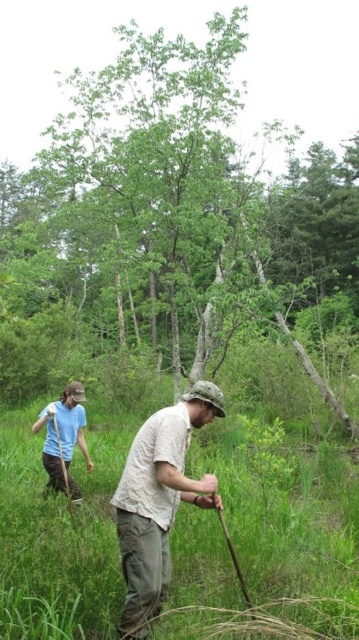
Question: Which of these objects is positioned closest to the matte blue shirt at left?

Choices:
 (A) beige cotton shirt at center
 (B) green grassy at center

Answer: (A)

Question: Considering the relative positions of green grassy at center and matte blue shirt at left in the image provided, where is green grassy at center located with respect to matte blue shirt at left?

Choices:
 (A) below
 (B) above

Answer: (A)

Question: Which object is positioned farthest from the green grassy at center?

Choices:
 (A) matte blue shirt at left
 (B) beige cotton shirt at center

Answer: (A)

Question: Among these objects, which one is farthest from the camera?

Choices:
 (A) green leafy tree at center
 (B) green grassy at center
 (C) matte blue shirt at left
 (D) beige cotton shirt at center

Answer: (A)

Question: Can you confirm if green grassy at center is positioned above beige cotton shirt at center?

Choices:
 (A) no
 (B) yes

Answer: (A)

Question: Can you confirm if green leafy tree at center is positioned to the right of green grassy at center?

Choices:
 (A) yes
 (B) no

Answer: (B)